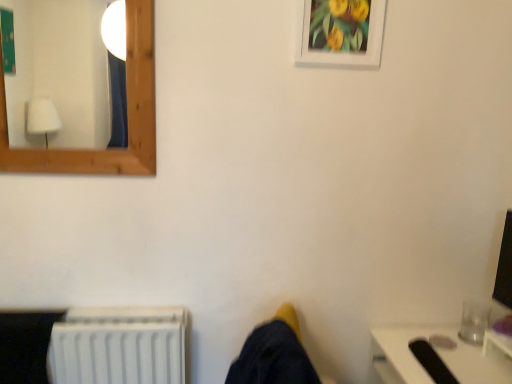
The image size is (512, 384). What do you see at coordinates (342, 33) in the screenshot? I see `white matte picture frame at upper center` at bounding box center [342, 33].

Measure the distance between point (x=6, y=50) and camera.

The depth of point (x=6, y=50) is 3.81 meters.

In order to click on wooden frame mirror at upper left in this screenshot , I will do `click(62, 75)`.

This screenshot has height=384, width=512. What do you see at coordinates (120, 346) in the screenshot?
I see `white plastic radiator at lower left` at bounding box center [120, 346].

Locate an element on the screen. white matte picture frame at upper center is located at coordinates (342, 33).

Where is `mirror above the white plastic radiator at lower left (from a real-world perspective)`? mirror above the white plastic radiator at lower left (from a real-world perspective) is located at coordinates (62, 75).

From the image's perspective, between wooden frame mirror at upper left and white plastic radiator at lower left, which one is located above?

wooden frame mirror at upper left is shown above in the image.

Is wooden frame mirror at upper left looking in the opposite direction of white plastic radiator at lower left?

wooden frame mirror at upper left does not have its back to white plastic radiator at lower left.

Considering the sizes of objects wooden frame mirror at upper left and white plastic radiator at lower left in the image provided, who is wider, wooden frame mirror at upper left or white plastic radiator at lower left?

Wider between the two is white plastic radiator at lower left.

Could you tell me if white plastic radiator at lower left is facing wooden frame mirror at upper left?

No.

Can we say white plastic radiator at lower left lies outside wooden frame mirror at upper left?

Yes, white plastic radiator at lower left is outside of wooden frame mirror at upper left.

From a real-world perspective, which is physically below, white plastic radiator at lower left or wooden frame mirror at upper left?

From a 3D spatial view, white plastic radiator at lower left is below.

Is white plastic radiator at lower left positioned behind wooden frame mirror at upper left?

Yes, it is.

Is white plastic radiator at lower left oriented away from white matte picture frame at upper center?

No, white plastic radiator at lower left is not facing away from white matte picture frame at upper center.

Does white plastic radiator at lower left have a smaller size compared to white matte picture frame at upper center?

No, white plastic radiator at lower left is not smaller than white matte picture frame at upper center.

What's the angular difference between white plastic radiator at lower left and white matte picture frame at upper center's facing directions?

0.143 degrees separate the facing orientations of white plastic radiator at lower left and white matte picture frame at upper center.

Is white plastic radiator at lower left situated inside white matte picture frame at upper center or outside?

white plastic radiator at lower left is not inside white matte picture frame at upper center, it's outside.

From a real-world perspective, relative to wooden frame mirror at upper left, is white matte picture frame at upper center vertically above or below?

In terms of real-world spatial position, white matte picture frame at upper center is above wooden frame mirror at upper left.

Looking at the image, does white matte picture frame at upper center seem bigger or smaller compared to wooden frame mirror at upper left?

In the image, white matte picture frame at upper center appears to be smaller than wooden frame mirror at upper left.

Which is further, (362,41) or (71,125)?

Point (71,125)

Would you consider white matte picture frame at upper center to be distant from wooden frame mirror at upper left?

white matte picture frame at upper center is positioned a significant distance from wooden frame mirror at upper left.

Is white matte picture frame at upper center located outside white plastic radiator at lower left?

white matte picture frame at upper center is positioned outside white plastic radiator at lower left.

Considering the sizes of white matte picture frame at upper center and white plastic radiator at lower left in the image, is white matte picture frame at upper center wider or thinner than white plastic radiator at lower left?

Considering their sizes, white matte picture frame at upper center looks slimmer than white plastic radiator at lower left.

Between white matte picture frame at upper center and white plastic radiator at lower left, which one has more height?

Standing taller between the two is white plastic radiator at lower left.

Between wooden frame mirror at upper left and white matte picture frame at upper center, which one has larger width?

With larger width is wooden frame mirror at upper left.

Does wooden frame mirror at upper left touch white matte picture frame at upper center?

No, wooden frame mirror at upper left is not touching white matte picture frame at upper center.

Measure the distance between wooden frame mirror at upper left and white matte picture frame at upper center.

wooden frame mirror at upper left is 3.49 meters from white matte picture frame at upper center.

Which of these two, wooden frame mirror at upper left or white matte picture frame at upper center, is bigger?

Bigger between the two is wooden frame mirror at upper left.

Locate an element on the screen. The height and width of the screenshot is (384, 512). mirror lying above the white plastic radiator at lower left (from the image's perspective) is located at coordinates point(62,75).

Find the location of a particular element. radiator that appears below the wooden frame mirror at upper left (from the image's perspective) is located at coordinates (120, 346).

Estimate the real-world distances between objects in this image. Which object is further from white matte picture frame at upper center, white plastic radiator at lower left or wooden frame mirror at upper left?

wooden frame mirror at upper left is further to white matte picture frame at upper center.

From the image, which object appears to be farther from wooden frame mirror at upper left, white matte picture frame at upper center or white plastic radiator at lower left?

white matte picture frame at upper center is positioned further to the anchor wooden frame mirror at upper left.

When comparing their distances from wooden frame mirror at upper left, does white plastic radiator at lower left or white matte picture frame at upper center seem further?

white matte picture frame at upper center is positioned further to the anchor wooden frame mirror at upper left.

When comparing their distances from white plastic radiator at lower left, does white matte picture frame at upper center or wooden frame mirror at upper left seem closer?

Based on the image, white matte picture frame at upper center appears to be nearer to white plastic radiator at lower left.

Which object lies further to the anchor point white matte picture frame at upper center, wooden frame mirror at upper left or white plastic radiator at lower left?

wooden frame mirror at upper left.

Considering their positions, is wooden frame mirror at upper left positioned further to white plastic radiator at lower left than white matte picture frame at upper center?

Among the two, wooden frame mirror at upper left is located further to white plastic radiator at lower left.

Where is `mirror between white matte picture frame at upper center and white plastic radiator at lower left in the up-down direction`? The width and height of the screenshot is (512, 384). mirror between white matte picture frame at upper center and white plastic radiator at lower left in the up-down direction is located at coordinates (62, 75).